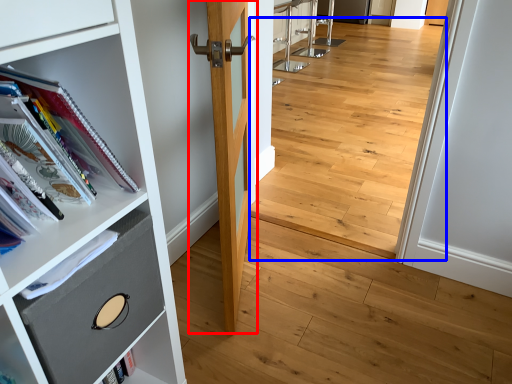
Question: Which point is closer to the camera, door (highlighted by a red box) or corridor (highlighted by a blue box)?

Choices:
 (A) door
 (B) corridor

Answer: (A)